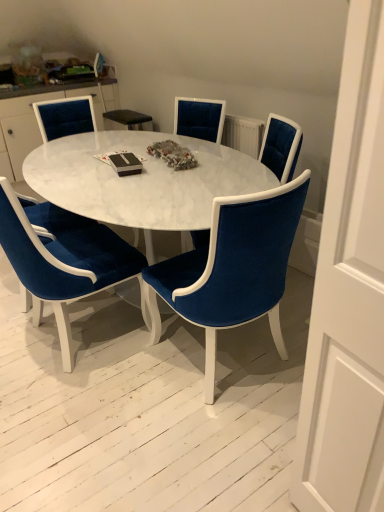
This screenshot has width=384, height=512. In order to click on free space in front of velvet blue chair at center, which is the fourth chair in left-to-right order in this screenshot , I will do `click(201, 445)`.